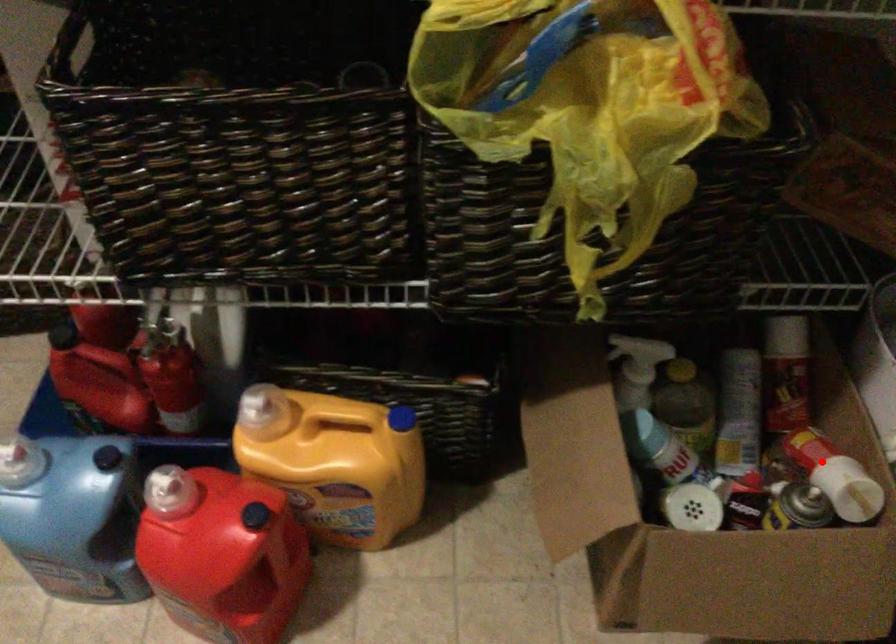
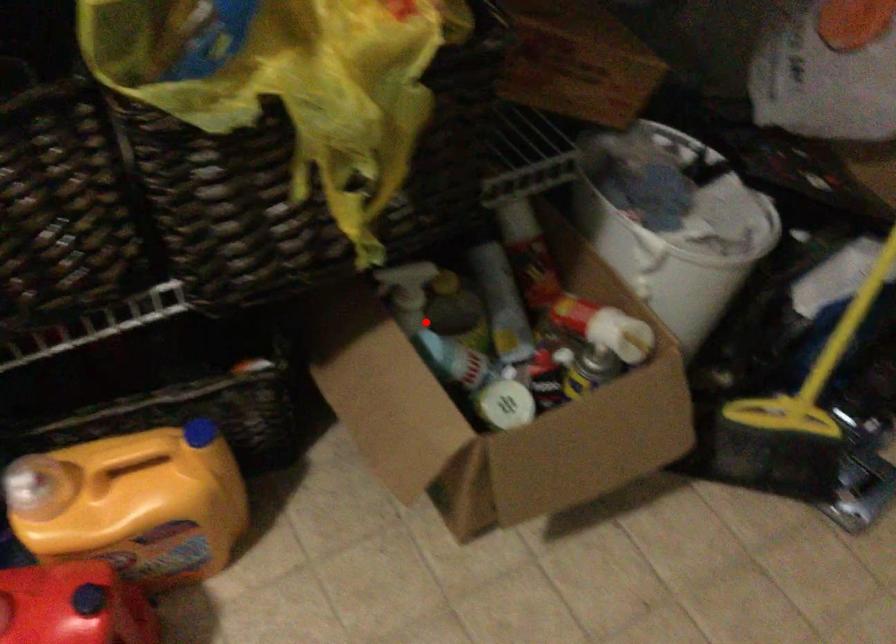
I am providing you with two images of the same scene from different viewpoints. A red point is marked on the first image and another point is marked on the second image. Does the point marked in image1 correspond to the same location as the one in image2?

No